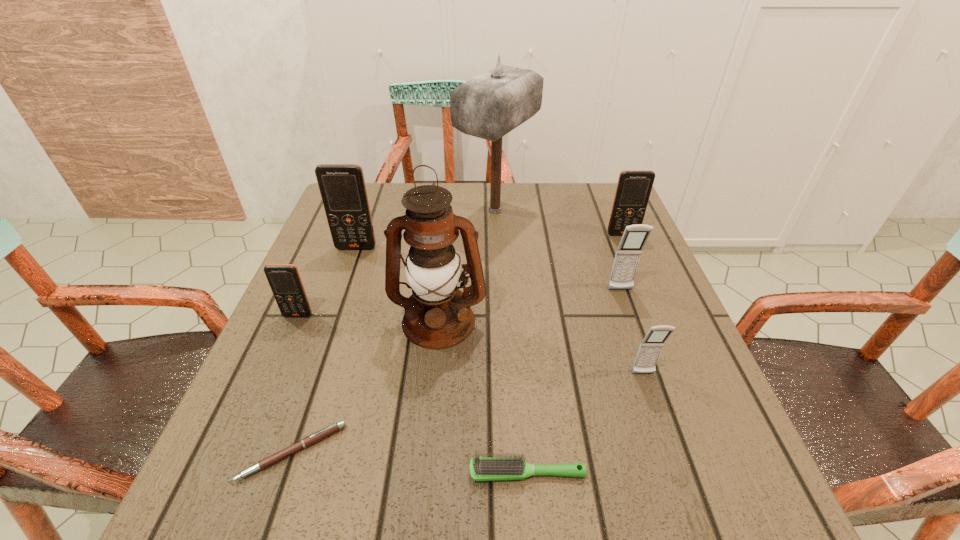
Where is `free space at the far edge`? free space at the far edge is located at coordinates (537, 189).

In the image, there is a desktop. Identify the location of free space at the near edge. (638, 500).

Identify the location of free space at the left edge of the desktop. This screenshot has height=540, width=960. (317, 367).

This screenshot has width=960, height=540. In the image, there is a desktop. Identify the location of vacant space at the right edge. point(600,295).

Identify the location of vacant space at the far left corner of the desktop. The width and height of the screenshot is (960, 540). (392, 189).

In the image, there is a desktop. Where is `vacant space at the near left corner`? The width and height of the screenshot is (960, 540). vacant space at the near left corner is located at coordinates (227, 513).

Find the location of a particular element. The height and width of the screenshot is (540, 960). free space at the far right corner is located at coordinates (602, 186).

In order to click on free space at the near right corner of the desktop in this screenshot , I will do `click(695, 521)`.

Where is `free spot between the second smallest orange cellular telephone and the hairbrush`? This screenshot has height=540, width=960. free spot between the second smallest orange cellular telephone and the hairbrush is located at coordinates (575, 353).

Image resolution: width=960 pixels, height=540 pixels. I want to click on free space between the mallet and the farthest cellular telephone, so click(559, 222).